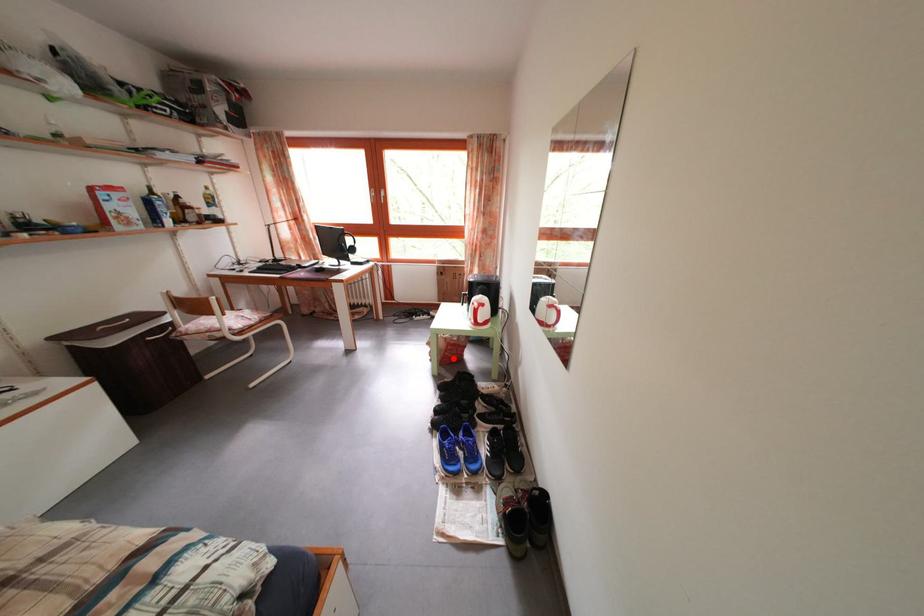
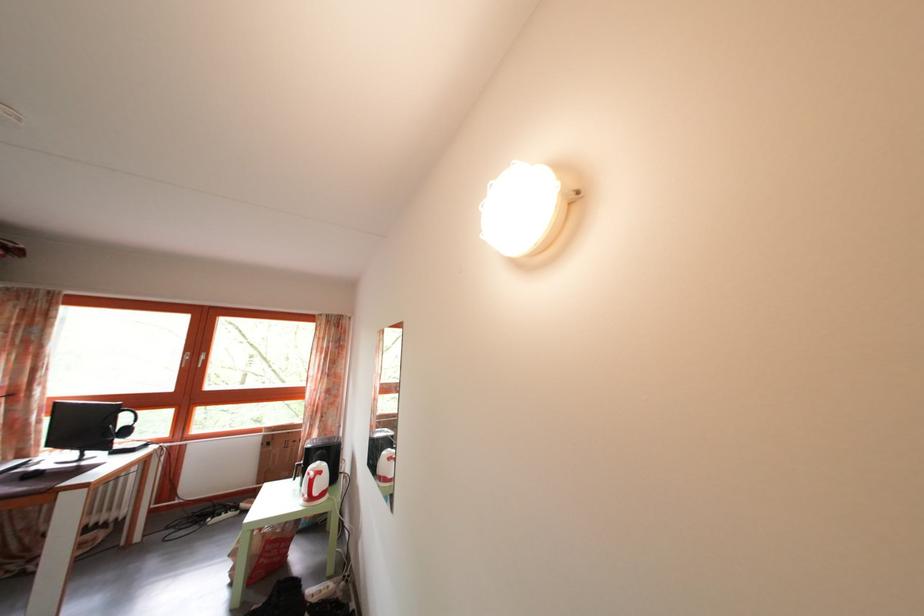
Locate, in the second image, the point that corresponds to the highlighted location in the first image.

(268, 562)